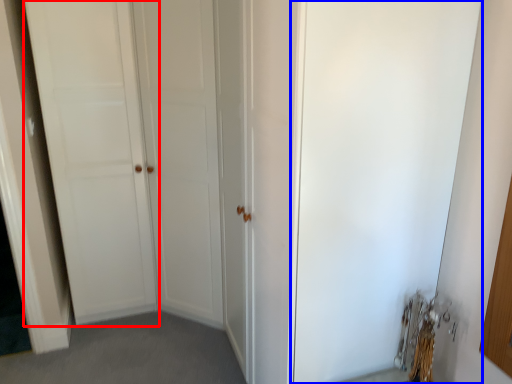
Question: Which object appears closest to the camera in this image, door (highlighted by a red box) or screen door (highlighted by a blue box)?

Choices:
 (A) door
 (B) screen door

Answer: (B)